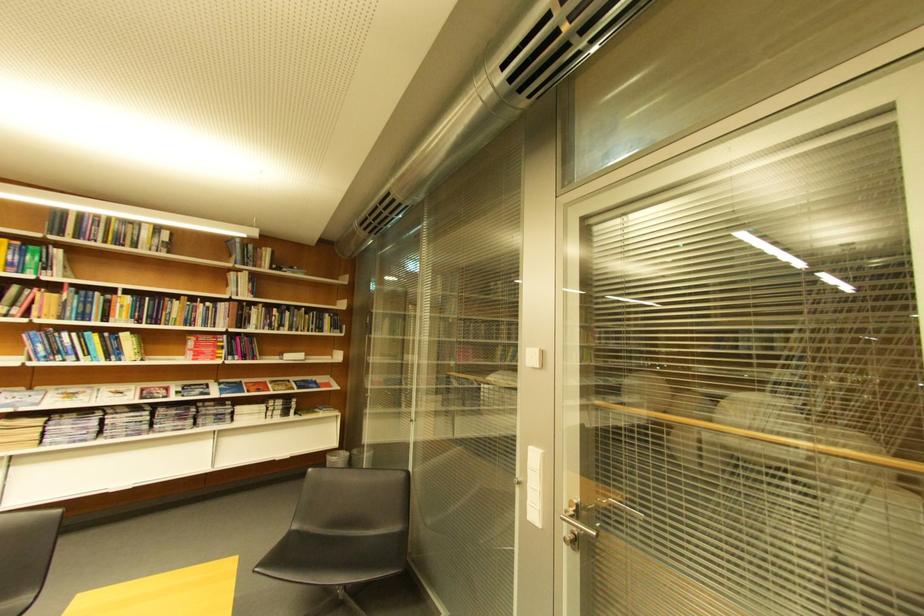
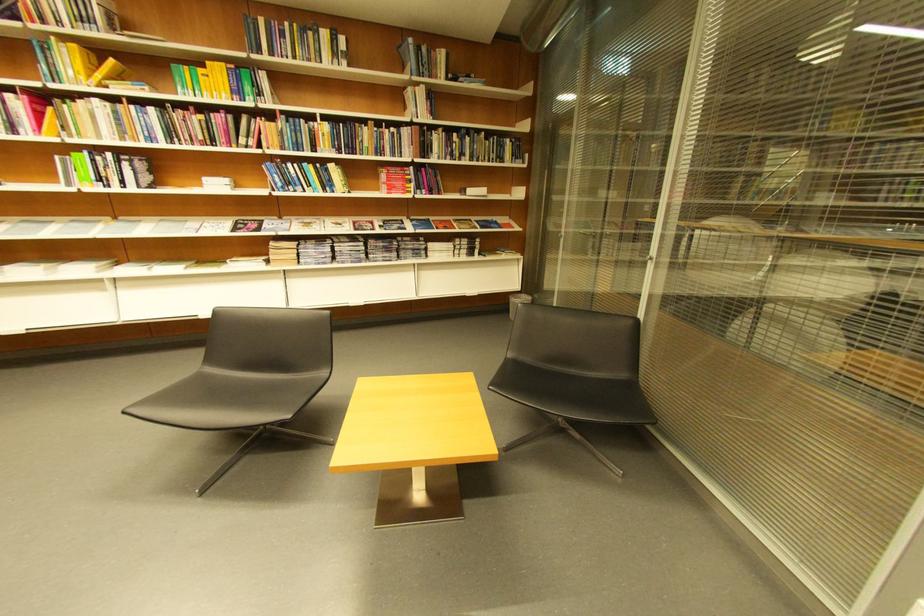
In the second image, find the point that corresponds to [53,355] in the first image.

(290, 185)